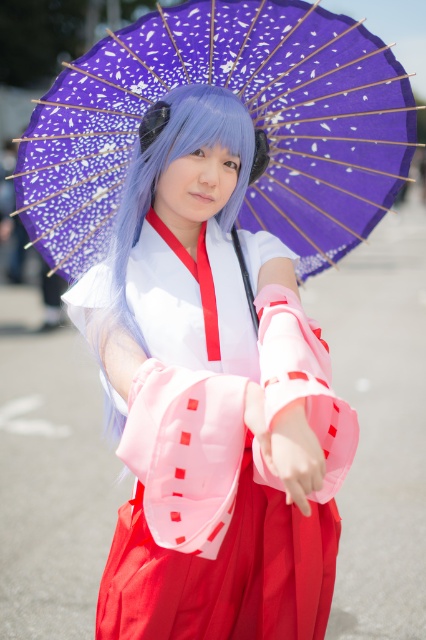
Question: Is matte pink kimono at center positioned before purple paper umbrella at upper center?

Choices:
 (A) yes
 (B) no

Answer: (A)

Question: Which object is farther from the camera taking this photo?

Choices:
 (A) matte pink kimono at center
 (B) purple paper umbrella at upper center

Answer: (B)

Question: Which of the following is the closest to the observer?

Choices:
 (A) purple paper umbrella at upper center
 (B) matte pink kimono at center

Answer: (B)

Question: From the image, what is the correct spatial relationship of matte pink kimono at center in relation to purple paper umbrella at upper center?

Choices:
 (A) below
 (B) above

Answer: (A)

Question: Does matte pink kimono at center appear over purple paper umbrella at upper center?

Choices:
 (A) no
 (B) yes

Answer: (A)

Question: Which point is closer to the camera taking this photo?

Choices:
 (A) (166, 316)
 (B) (36, 179)

Answer: (A)